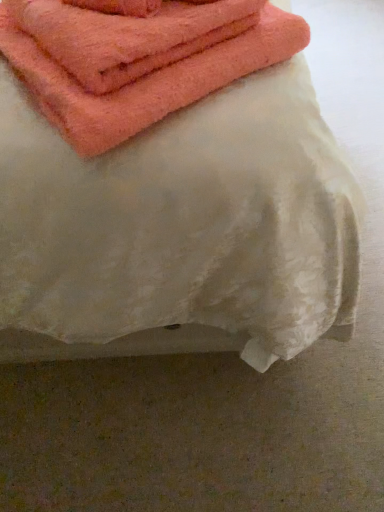
Question: Can you confirm if coral soft towel at upper left is thinner than white textured fabric at upper center?

Choices:
 (A) no
 (B) yes

Answer: (B)

Question: From a real-world perspective, is coral soft towel at upper left located higher than white textured fabric at upper center?

Choices:
 (A) no
 (B) yes

Answer: (B)

Question: Can you confirm if coral soft towel at upper left is smaller than white textured fabric at upper center?

Choices:
 (A) no
 (B) yes

Answer: (B)

Question: Could you tell me if coral soft towel at upper left is facing white textured fabric at upper center?

Choices:
 (A) no
 (B) yes

Answer: (B)

Question: Could white textured fabric at upper center be considered to be inside coral soft towel at upper left?

Choices:
 (A) no
 (B) yes

Answer: (A)

Question: Can you confirm if coral soft towel at upper left is bigger than white textured fabric at upper center?

Choices:
 (A) no
 (B) yes

Answer: (A)

Question: Can you confirm if white textured fabric at upper center is bigger than coral soft towel at upper left?

Choices:
 (A) no
 (B) yes

Answer: (B)

Question: From the image's perspective, is white textured fabric at upper center located above coral soft towel at upper left?

Choices:
 (A) yes
 (B) no

Answer: (A)

Question: Are white textured fabric at upper center and coral soft towel at upper left located far from each other?

Choices:
 (A) no
 (B) yes

Answer: (A)

Question: Can coral soft towel at upper left be found inside white textured fabric at upper center?

Choices:
 (A) yes
 (B) no

Answer: (A)

Question: Could you tell me if white textured fabric at upper center is turned towards coral soft towel at upper left?

Choices:
 (A) yes
 (B) no

Answer: (A)

Question: From a real-world perspective, is white textured fabric at upper center located higher than coral soft towel at upper left?

Choices:
 (A) no
 (B) yes

Answer: (A)

Question: Based on their sizes in the image, would you say coral soft towel at upper left is bigger or smaller than white textured fabric at upper center?

Choices:
 (A) small
 (B) big

Answer: (A)